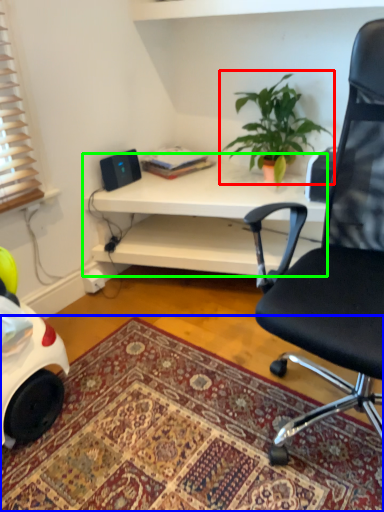
Question: Which is nearer to the houseplant (highlighted by a red box)? mat (highlighted by a blue box) or desk (highlighted by a green box).

Choices:
 (A) mat
 (B) desk

Answer: (B)